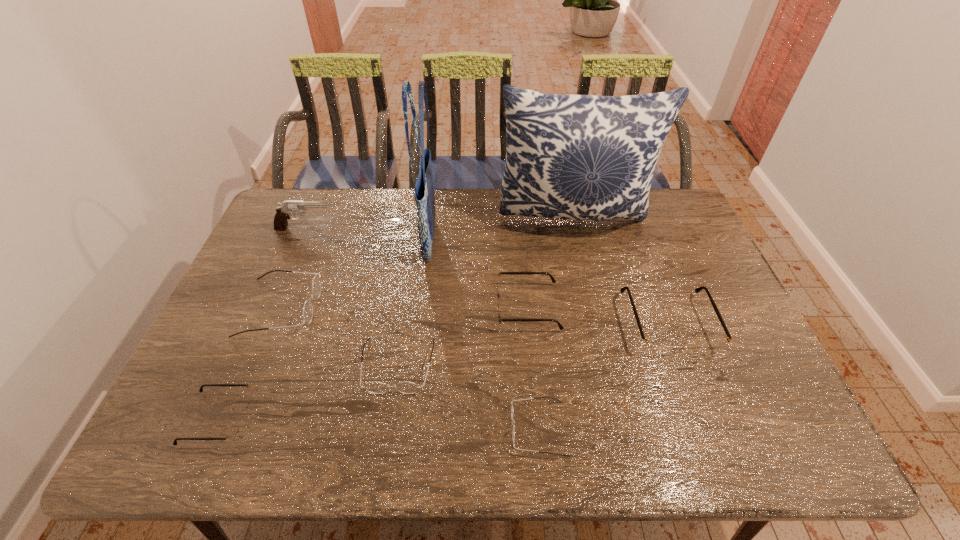
Identify the location of the nearest black spectacles. The height and width of the screenshot is (540, 960). (233, 432).

Find the location of a particular element. The height and width of the screenshot is (540, 960). the rightmost dark spectacles is located at coordinates (537, 397).

I want to click on the smallest dark spectacles, so click(x=537, y=397).

You are a GUI agent. You are given a task and a screenshot of the screen. Output one action in this format:
    pyautogui.click(x=<x>, y=<y>)
    Task: Click on the free spot located 0.110m on the front-facing side of the shopping bag
    
    Given the screenshot: What is the action you would take?
    pyautogui.click(x=471, y=241)

Find the location of a particular element. The image size is (960, 540). vacant space situated on the front surface of the blue cushion is located at coordinates click(588, 284).

Image resolution: width=960 pixels, height=540 pixels. Find the location of `blank area located 0.370m at the muzzle of the third tallest object`. blank area located 0.370m at the muzzle of the third tallest object is located at coordinates (446, 229).

Where is `blank area located 0.150m at the hinge ends of the biggest black spectacles`? Image resolution: width=960 pixels, height=540 pixels. blank area located 0.150m at the hinge ends of the biggest black spectacles is located at coordinates (702, 414).

What are the coordinates of `vacant space located through the lenses of the leftmost dark spectacles` in the screenshot? It's located at (364, 307).

Locate an element on the screen. Image resolution: width=960 pixels, height=540 pixels. vacant point located at the hinge ends of the second black spectacles from left to right is located at coordinates (435, 307).

The width and height of the screenshot is (960, 540). In order to click on vacant space located 0.210m at the hinge ends of the second black spectacles from left to right in this screenshot , I will do `click(421, 307)`.